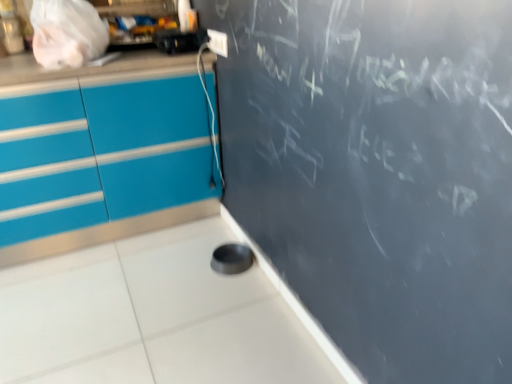
At what (x,y) coordinates should I click in order to perform the action: click on white plastic electric outlet at upper center. Please return your answer as a coordinate pair (x, y). The height and width of the screenshot is (384, 512). Looking at the image, I should click on (218, 42).

Measure the distance between white plastic electric outlet at upper center and camera.

The depth of white plastic electric outlet at upper center is 1.85 meters.

The width and height of the screenshot is (512, 384). What do you see at coordinates (218, 42) in the screenshot?
I see `white plastic electric outlet at upper center` at bounding box center [218, 42].

This screenshot has width=512, height=384. Describe the element at coordinates (179, 40) in the screenshot. I see `black plastic toaster at upper left` at that location.

I want to click on black plastic toaster at upper left, so click(x=179, y=40).

Identify the location of white plastic electric outlet at upper center. (218, 42).

Would you say black plastic toaster at upper left is to the left or to the right of white plastic electric outlet at upper center in the picture?

In the image, black plastic toaster at upper left appears on the left side of white plastic electric outlet at upper center.

Which object is more forward, black plastic toaster at upper left or white plastic electric outlet at upper center?

Positioned in front is black plastic toaster at upper left.

Which is in front, point (197, 42) or point (227, 53)?

The point (227, 53) is in front.

From the image's perspective, which is above, black plastic toaster at upper left or white plastic electric outlet at upper center?

black plastic toaster at upper left appears higher in the image.

From a real-world perspective, does black plastic toaster at upper left stand above white plastic electric outlet at upper center?

Correct, in the physical world, black plastic toaster at upper left is higher than white plastic electric outlet at upper center.

Between black plastic toaster at upper left and white plastic electric outlet at upper center, which one has smaller width?

white plastic electric outlet at upper center is thinner.

Which of these two, black plastic toaster at upper left or white plastic electric outlet at upper center, stands taller?

black plastic toaster at upper left.

Looking at this image, considering the relative sizes of black plastic toaster at upper left and white plastic electric outlet at upper center in the image provided, is black plastic toaster at upper left bigger than white plastic electric outlet at upper center?

Yes.

Which is correct: black plastic toaster at upper left is inside white plastic electric outlet at upper center, or outside of it?

black plastic toaster at upper left is spatially situated outside white plastic electric outlet at upper center.

Is black plastic toaster at upper left not close to white plastic electric outlet at upper center?

black plastic toaster at upper left is near white plastic electric outlet at upper center, not far away.

Could you tell me if black plastic toaster at upper left is turned towards white plastic electric outlet at upper center?

No, black plastic toaster at upper left does not turn towards white plastic electric outlet at upper center.

How different are the orientations of black plastic toaster at upper left and white plastic electric outlet at upper center in degrees?

89.6 degrees separate the facing orientations of black plastic toaster at upper left and white plastic electric outlet at upper center.

Where is `electric outlet behind the black plastic toaster at upper left`? This screenshot has height=384, width=512. electric outlet behind the black plastic toaster at upper left is located at coordinates (218, 42).

Which is more to the right, white plastic electric outlet at upper center or black plastic toaster at upper left?

Positioned to the right is white plastic electric outlet at upper center.

Relative to black plastic toaster at upper left, is white plastic electric outlet at upper center in front or behind?

In the image, white plastic electric outlet at upper center appears behind black plastic toaster at upper left.

Does point (224, 51) appear closer or farther from the camera than point (174, 39)?

Point (224, 51) appears to be closer to the viewer than point (174, 39).

From the image's perspective, is white plastic electric outlet at upper center over black plastic toaster at upper left?

No, from the image's perspective, white plastic electric outlet at upper center is not above black plastic toaster at upper left.

From a real-world perspective, which is physically below, white plastic electric outlet at upper center or black plastic toaster at upper left?

In real-world perspective, white plastic electric outlet at upper center is lower.

Considering the relative sizes of white plastic electric outlet at upper center and black plastic toaster at upper left in the image provided, is white plastic electric outlet at upper center thinner than black plastic toaster at upper left?

Yes, white plastic electric outlet at upper center is thinner than black plastic toaster at upper left.

Does white plastic electric outlet at upper center have a lesser height compared to black plastic toaster at upper left?

Yes.

Considering the sizes of objects white plastic electric outlet at upper center and black plastic toaster at upper left in the image provided, who is bigger, white plastic electric outlet at upper center or black plastic toaster at upper left?

black plastic toaster at upper left.

Is black plastic toaster at upper left inside white plastic electric outlet at upper center?

No, black plastic toaster at upper left is not a part of white plastic electric outlet at upper center.

Are white plastic electric outlet at upper center and black plastic toaster at upper left far apart?

Actually, white plastic electric outlet at upper center and black plastic toaster at upper left are a little close together.

Is white plastic electric outlet at upper center facing towards black plastic toaster at upper left?

Yes, white plastic electric outlet at upper center is turned towards black plastic toaster at upper left.

How far apart are white plastic electric outlet at upper center and black plastic toaster at upper left?

6.51 inches.

Find the location of a particular element. electric outlet directly beneath the black plastic toaster at upper left (from a real-world perspective) is located at coordinates (218, 42).

Identify the location of appliance above the white plastic electric outlet at upper center (from a real-world perspective). The image size is (512, 384). (179, 40).

Locate an element on the screen. electric outlet that appears on the right of black plastic toaster at upper left is located at coordinates (218, 42).